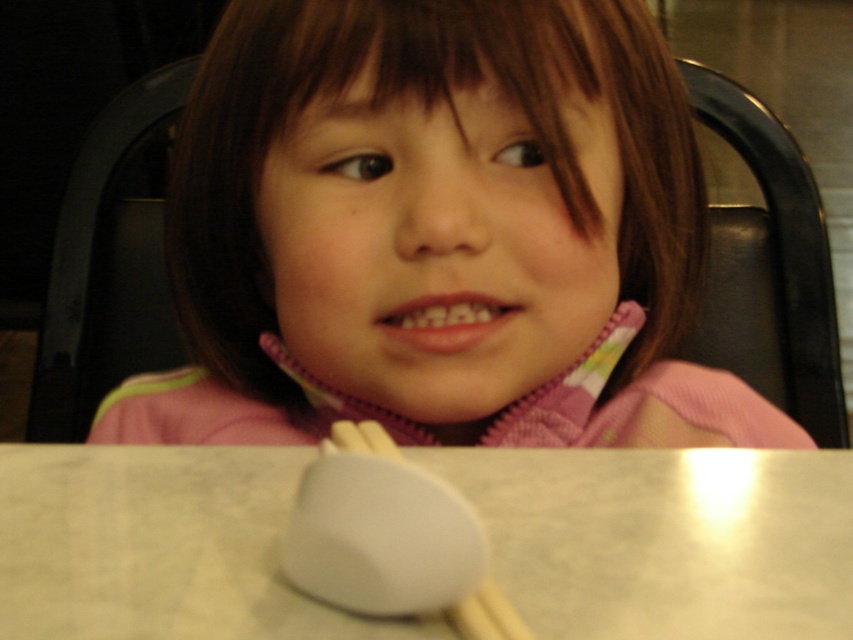
Question: Estimate the real-world distances between objects in this image. Which object is farther from the white wood chopstick at lower center?

Choices:
 (A) black plastic chair at upper left
 (B) pink matte teeth at center

Answer: (A)

Question: Which object is the closest to the white wood chopstick at lower center?

Choices:
 (A) white marble table at center
 (B) pink fleece at center
 (C) black plastic chair at upper left

Answer: (A)

Question: Which object is positioned closest to the black leather chair at upper right?

Choices:
 (A) pink fleece at center
 (B) pink matte teeth at center
 (C) black plastic chair at upper left
 (D) white marble table at center

Answer: (A)

Question: Can you confirm if black leather chair at upper right is smaller than black plastic chair at upper left?

Choices:
 (A) yes
 (B) no

Answer: (B)

Question: From the image, what is the correct spatial relationship of black leather chair at upper right in relation to black plastic chair at upper left?

Choices:
 (A) left
 (B) right

Answer: (B)

Question: Can you confirm if black leather chair at upper right is positioned below white wood chopstick at lower center?

Choices:
 (A) yes
 (B) no

Answer: (B)